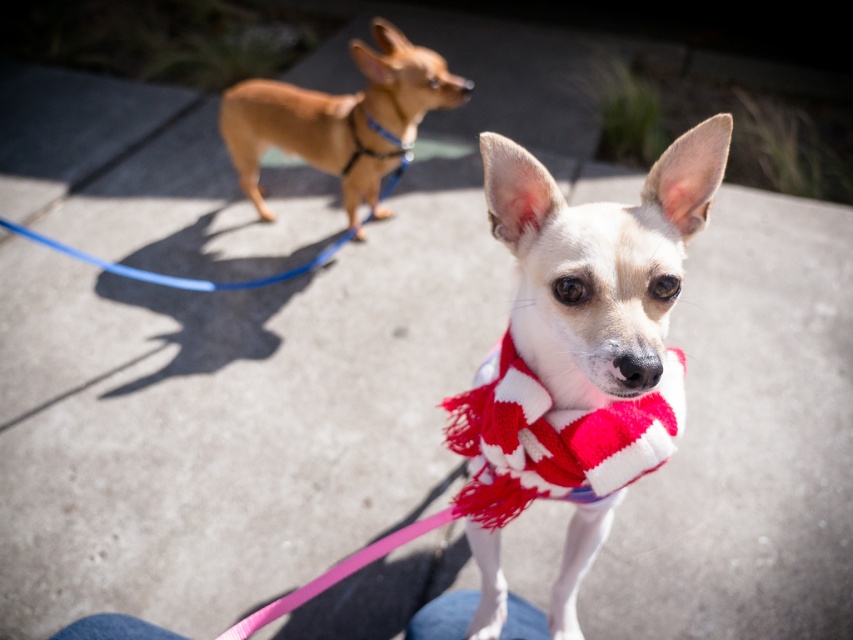
Can you confirm if pink fabric leash at center is wider than blue rubber leash at upper left?

In fact, pink fabric leash at center might be narrower than blue rubber leash at upper left.

Is pink fabric leash at center below blue rubber leash at upper left?

Indeed, pink fabric leash at center is positioned under blue rubber leash at upper left.

Where is `pink fabric leash at center`? This screenshot has height=640, width=853. pink fabric leash at center is located at coordinates (525, 458).

Image resolution: width=853 pixels, height=640 pixels. I want to click on pink fabric leash at center, so click(x=525, y=458).

Does red knitted scarf at center appear on the left side of blue rubber leash at upper left?

In fact, red knitted scarf at center is to the right of blue rubber leash at upper left.

Is point (601, 412) more distant than point (108, 264)?

No, (601, 412) is closer to viewer.

Is point (656, 458) behind point (9, 224)?

No.

This screenshot has height=640, width=853. I want to click on red knitted scarf at center, so click(x=554, y=440).

Consider the image. Is white knitted scarf at center further to camera compared to blue rubber leash at upper left?

No, it is not.

Which is behind, point (717, 140) or point (300, 272)?

Point (300, 272)

Locate an element on the screen. The height and width of the screenshot is (640, 853). white knitted scarf at center is located at coordinates (599, 262).